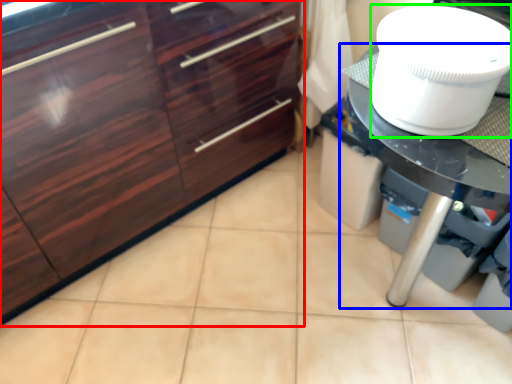
Question: Estimate the real-world distances between objects in this image. Which object is closer to cabinetry (highlighted by a red box), countertop (highlighted by a blue box) or toilet bowl (highlighted by a green box)?

Choices:
 (A) countertop
 (B) toilet bowl

Answer: (B)